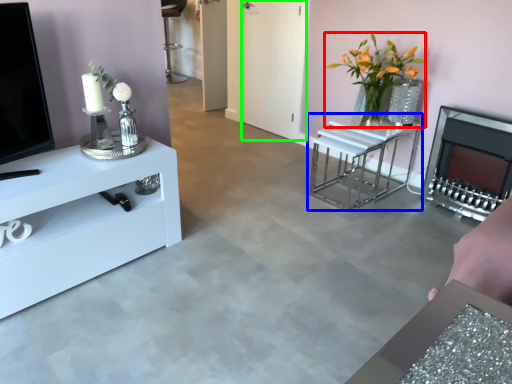
Question: Estimate the real-world distances between objects in this image. Which object is farther from floral arrangement (highlighted by a red box), table (highlighted by a blue box) or glass door (highlighted by a green box)?

Choices:
 (A) table
 (B) glass door

Answer: (B)